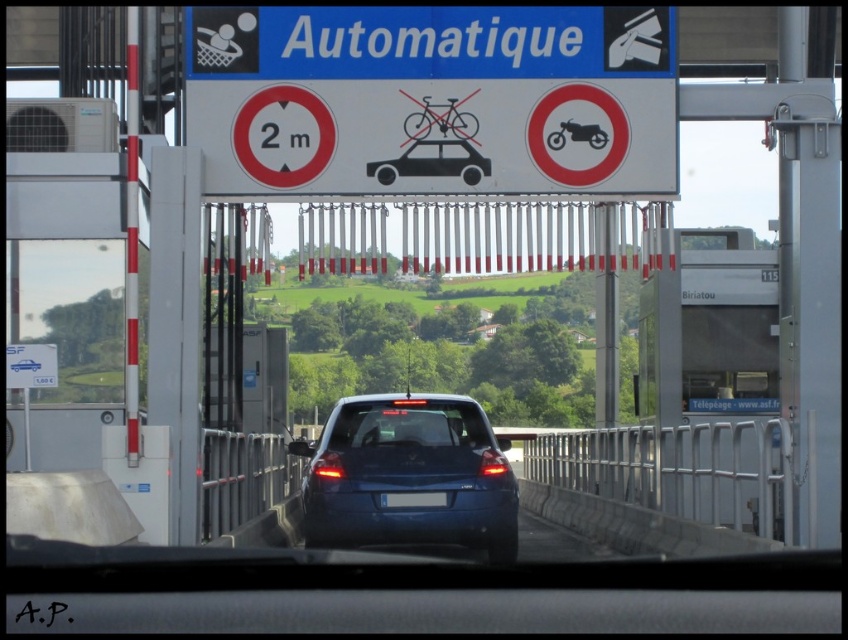
You are driving a car and need to park it in a specific spot. You see a blue matte car at center and a blue plastic license plate at center in the parking area. Which object should you align your car with to park correctly?

You should align your car with the blue plastic license plate at center because the blue matte car at center is positioned over it, indicating that the license plate is the designated parking spot.

You are driving a car that is 4 meters long. You need to pass through the toll booth lane. The gray metallic barrier at center and blue plastic license plate at center are important for your vehicle to clear. Can your car fit through the space between them?

The gray metallic barrier at center and blue plastic license plate at center are 3.56 meters apart. Since your car is 4 meters long, it is longer than the available space between them. Therefore, your car cannot fit through the space between the gray metallic barrier at center and blue plastic license plate at center.

You are driving a car that is 10 feet long. You see a blue matte car at center and a gray metallic barrier at center ahead. Can your car fit entirely between them without touching either?

The blue matte car at center is 10.64 feet from the gray metallic barrier at center. Since your car is 10 feet long, it can fit between them with 0.64 feet of space remaining.